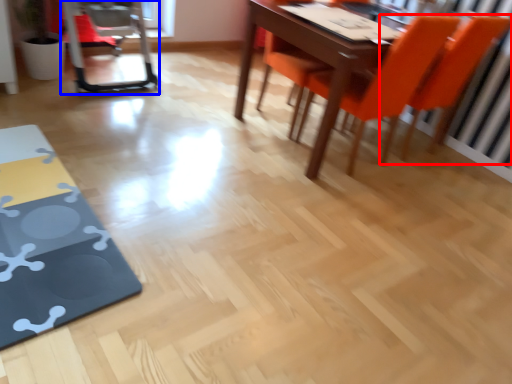
Question: Which point is closer to the camera, chair (highlighted by a red box) or swivel chair (highlighted by a blue box)?

Choices:
 (A) chair
 (B) swivel chair

Answer: (A)